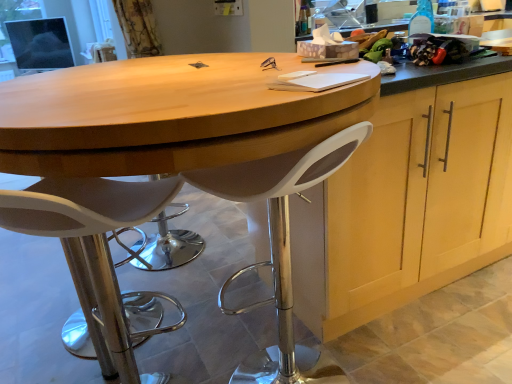
Question: Is wooden table at center inside or outside of white plastic stool at center, the second chair viewed from the left?

Choices:
 (A) outside
 (B) inside

Answer: (A)

Question: In terms of height, does wooden table at center look taller or shorter compared to white plastic stool at center, the second chair viewed from the left?

Choices:
 (A) short
 (B) tall

Answer: (B)

Question: Which of these objects is positioned closest to the white plastic stool at lower left, positioned as the 1th chair in left-to-right order?

Choices:
 (A) white plastic stool at center, which is the first chair from right to left
 (B) wooden table at center
 (C) light wood cabinet at center

Answer: (B)

Question: Which of these objects is positioned closest to the light wood cabinet at center?

Choices:
 (A) white plastic stool at lower left, positioned as the second chair in right-to-left order
 (B) white plastic stool at center, the second chair viewed from the left
 (C) wooden table at center

Answer: (B)